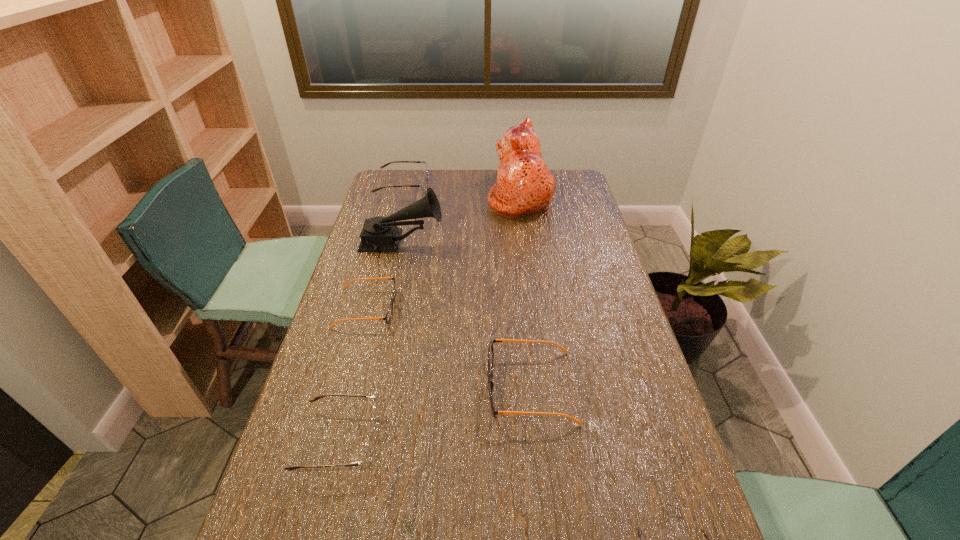
Image resolution: width=960 pixels, height=540 pixels. In order to click on spectacles that stands as the fourth closest to the second farthest spectacles in this screenshot , I will do `click(702, 529)`.

Select which brown spectacles is the closest to the second smallest brown spectacles. Please provide its 2D coordinates. Your answer should be formatted as a tuple, i.e. [(x, y)], where the tuple contains the x and y coordinates of a point satisfying the conditions above.

[(702, 529)]

I want to click on brown spectacles that can be found as the second closest to the biggest brown spectacles, so click(702, 529).

The image size is (960, 540). Find the location of `black spectacles that can be found as the closest to the biggest brown spectacles`. black spectacles that can be found as the closest to the biggest brown spectacles is located at coordinates (388, 315).

The height and width of the screenshot is (540, 960). Find the location of `black spectacles that stands as the closest to the second biggest brown spectacles`. black spectacles that stands as the closest to the second biggest brown spectacles is located at coordinates (490, 350).